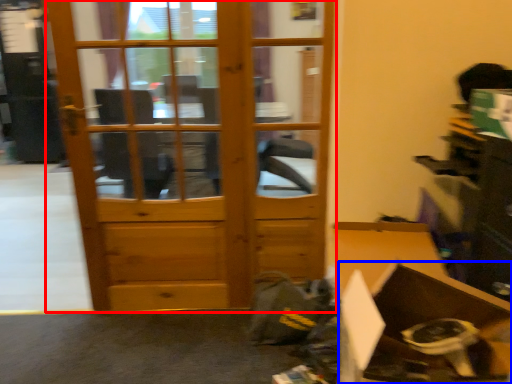
Question: Which object is closer to the camera taking this photo, door (highlighted by a red box) or cardboard box (highlighted by a blue box)?

Choices:
 (A) door
 (B) cardboard box

Answer: (B)